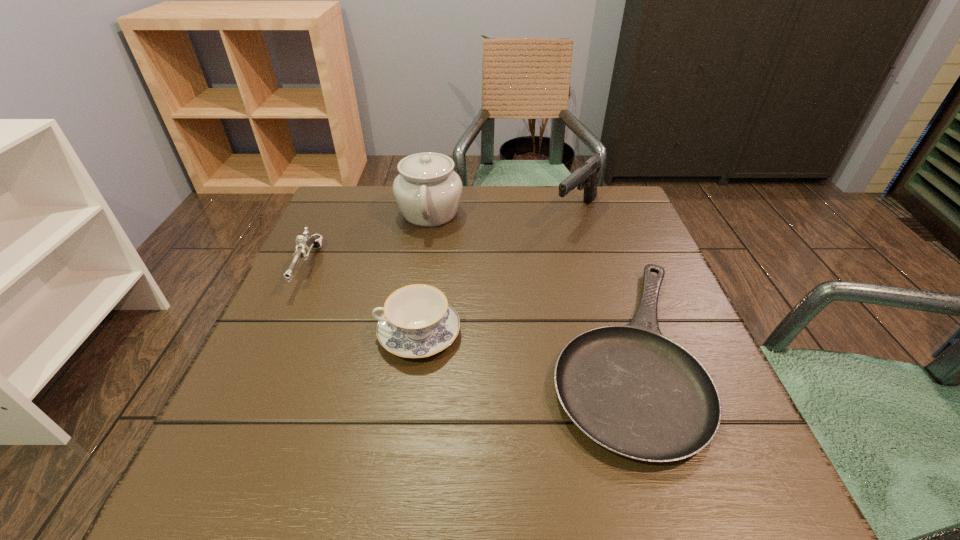
The width and height of the screenshot is (960, 540). What are the coordinates of `the farther chinaware` in the screenshot? It's located at (428, 191).

Find the location of `the farther gun`. the farther gun is located at coordinates (586, 175).

Where is `the right gun`? the right gun is located at coordinates (586, 175).

Find the location of a particular element. The height and width of the screenshot is (540, 960). the leftmost object is located at coordinates (304, 245).

I want to click on the shorter gun, so click(x=304, y=245).

Where is `the nearer chinaware`? the nearer chinaware is located at coordinates (417, 322).

Find the location of a particular element. This screenshot has height=540, width=960. the shortest object is located at coordinates (630, 389).

At what (x,y) coordinates should I click in order to perform the action: click on vacant space located 0.110m on the front of the taller chinaware. Please return your answer as a coordinate pair (x, y). This screenshot has height=540, width=960. Looking at the image, I should click on click(421, 267).

You are a GUI agent. You are given a task and a screenshot of the screen. Output one action in this format:
    pyautogui.click(x=<x>, y=<y>)
    Task: Click on the free space located 0.150m at the muzzle of the farther gun
    
    Given the screenshot: What is the action you would take?
    pyautogui.click(x=593, y=272)

This screenshot has height=540, width=960. In order to click on vacant region located 0.110m aimed along the barrel of the left gun in this screenshot , I will do `click(276, 335)`.